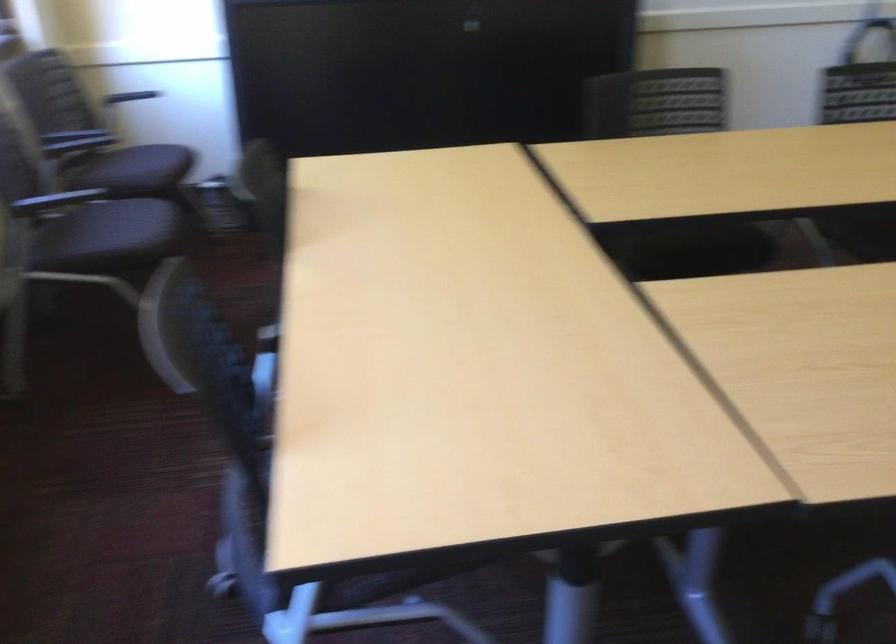
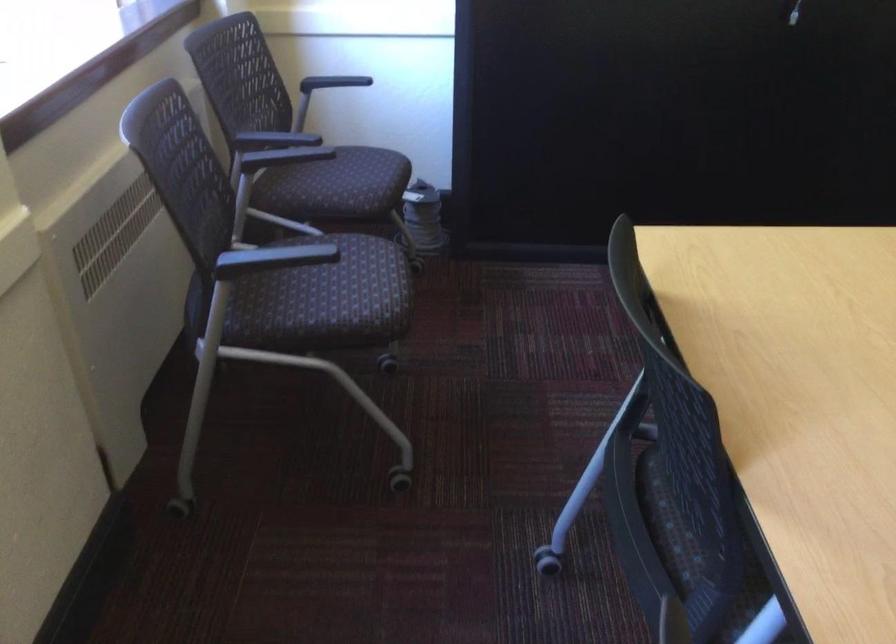
Question: The first image is from the beginning of the video and the second image is from the end. How did the camera likely rotate when shooting the video?

Choices:
 (A) Left
 (B) Right
 (C) Up
 (D) Down

Answer: (A)